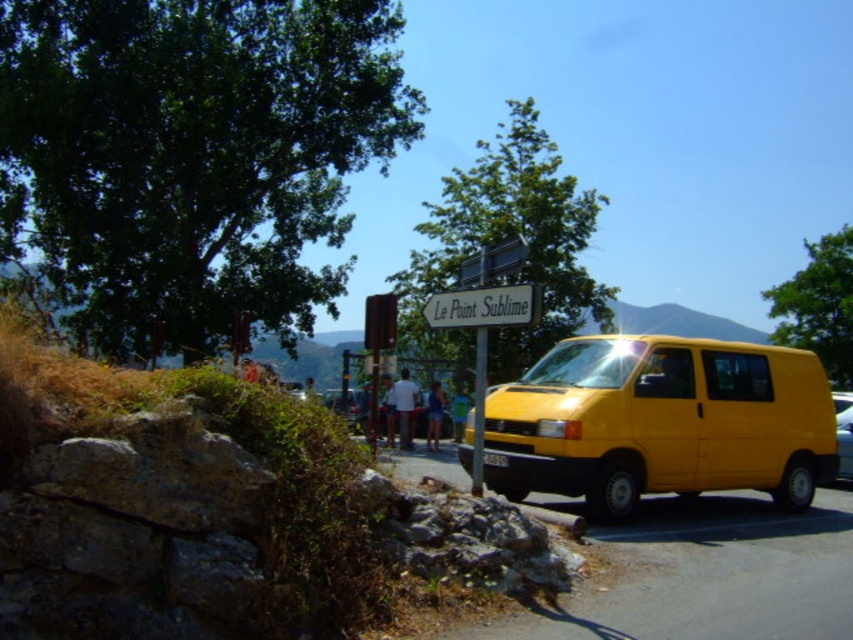
Can you confirm if yellow matte van at center is bigger than white matte shirt at center?

No, yellow matte van at center is not bigger than white matte shirt at center.

Which is behind, point (569, 436) or point (399, 436)?

Positioned behind is point (399, 436).

You are a GUI agent. You are given a task and a screenshot of the screen. Output one action in this format:
    pyautogui.click(x=<x>, y=<y>)
    Task: Click on the yellow matte van at center
    This screenshot has width=853, height=640.
    Given the screenshot: What is the action you would take?
    pyautogui.click(x=660, y=422)

Does white plastic sign at center have a lesser width compared to yellow matte van at right?

Yes, white plastic sign at center is thinner than yellow matte van at right.

Is white plastic sign at center bigger than yellow matte van at right?

Incorrect, white plastic sign at center is not larger than yellow matte van at right.

Find the location of a particular element. Image resolution: width=853 pixels, height=640 pixels. white plastic sign at center is located at coordinates (482, 307).

In the scene shown: Can you confirm if white matte shirt at center is positioned below blue denim shorts at center?

Incorrect, white matte shirt at center is not positioned below blue denim shorts at center.

Is point (412, 385) positioned behind point (436, 381)?

No, it is not.

Locate an element on the screen. The image size is (853, 640). white matte shirt at center is located at coordinates pos(404,406).